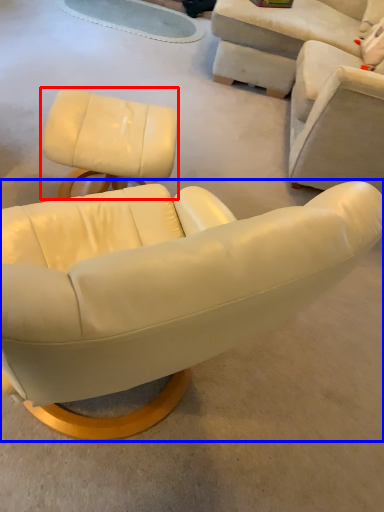
Question: Which point is further to the camera, chair (highlighted by a red box) or chair (highlighted by a blue box)?

Choices:
 (A) chair
 (B) chair

Answer: (A)